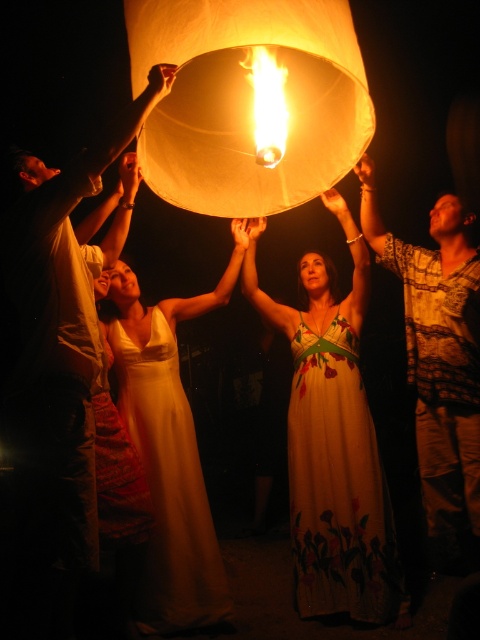
You are a photographer at the lantern release ceremony. You want to capture a photo where both the matte white dress at upper center and the printed cotton shirt at upper right are visible. Based on their positions, which one should you adjust your camera to focus on first to ensure both are in the frame?

The matte white dress at upper center is positioned on the left side of the printed cotton shirt at upper right. To ensure both are in the frame, focus on the printed cotton shirt at upper right first, as it is on the right, allowing the camera to capture the leftward position of the matte white dress at upper center as well.

You are a photographer at the lantern release ceremony. You want to capture a photo where both the white floral dress at center and the satin gold dress at center are visible. Which dress should you focus on to ensure the other is still in frame?

The white floral dress at center is located below the satin gold dress at center, so focusing on the satin gold dress at center would allow the white floral dress at center to be visible below it in the frame.